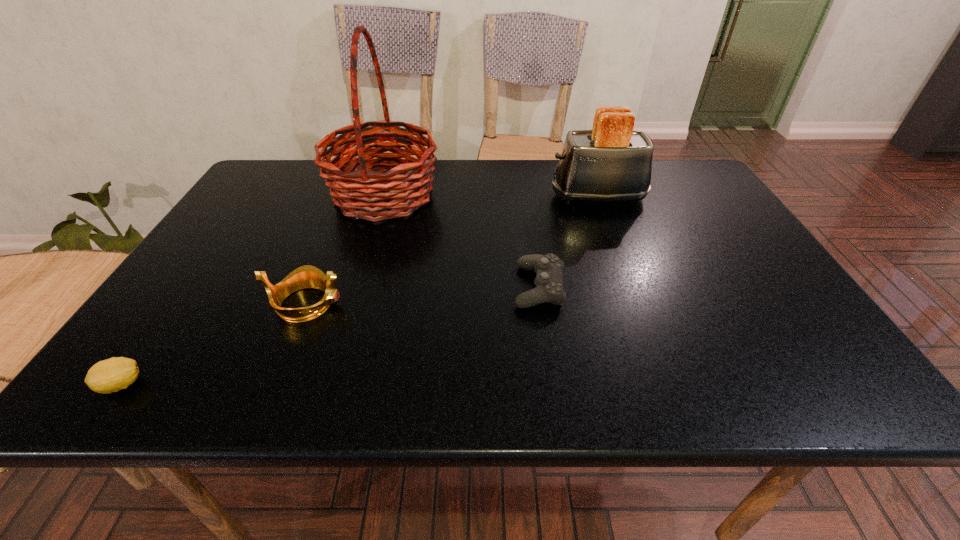
In order to click on free space at the near edge in this screenshot , I will do `click(668, 390)`.

Find the location of a particular element. vacant space at the left edge of the desktop is located at coordinates (210, 246).

This screenshot has width=960, height=540. Identify the location of vacant space at the right edge. (689, 202).

This screenshot has height=540, width=960. What are the coordinates of `empty location between the control and the nearest object` in the screenshot? It's located at (330, 336).

The image size is (960, 540). I want to click on vacant area that lies between the nearest object and the tiara, so click(214, 344).

Locate an element on the screen. The height and width of the screenshot is (540, 960). unoccupied area between the fourth object from left to right and the tiara is located at coordinates (422, 295).

You are a GUI agent. You are given a task and a screenshot of the screen. Output one action in this format:
    pyautogui.click(x=<x>, y=<y>)
    Task: Click on the free space between the tallest object and the toaster
    
    Given the screenshot: What is the action you would take?
    pyautogui.click(x=491, y=196)

The width and height of the screenshot is (960, 540). In order to click on unoccupied area between the control and the tallest object in this screenshot , I will do `click(462, 241)`.

Where is `free space between the lemon and the fourth object from left to right`? The height and width of the screenshot is (540, 960). free space between the lemon and the fourth object from left to right is located at coordinates (330, 336).

You are a GUI agent. You are given a task and a screenshot of the screen. Output one action in this format:
    pyautogui.click(x=<x>, y=<y>)
    Task: Click on the unoccupied position between the fourth shortest object and the fourth object from left to right
    The image size is (960, 540).
    Given the screenshot: What is the action you would take?
    pyautogui.click(x=568, y=241)